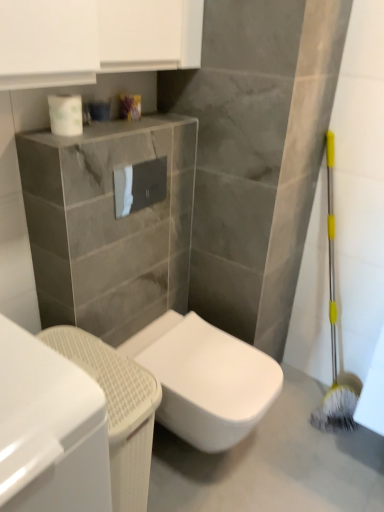
This screenshot has height=512, width=384. I want to click on white glossy toilet at center, so click(273, 464).

Locate an element on the screen. white glossy toilet at center is located at coordinates (205, 379).

At what (x,y) coordinates should I click in order to perform the action: click on white glossy toilet paper at upper center, placed as the 2th toilet paper when sorted from right to left. Please return your answer as a coordinate pair (x, y). The image size is (384, 512). Looking at the image, I should click on (65, 114).

From a real-world perspective, between white glossy toilet at center and white glossy toilet at center, who is vertically higher?

white glossy toilet at center, from a real-world perspective.

Can you confirm if white glossy toilet at center is positioned to the left of white glossy toilet at center?

In fact, white glossy toilet at center is to the right of white glossy toilet at center.

From the image's perspective, who appears lower, white glossy toilet at center or white glossy toilet at center?

From the image's view, white glossy toilet at center is below.

Considering the sizes of white glossy toilet at center and white glossy toilet at center in the image, is white glossy toilet at center taller or shorter than white glossy toilet at center?

white glossy toilet at center is shorter than white glossy toilet at center.

From the image's perspective, is white glossy toilet at lower left on top of white glossy toilet paper at upper center, acting as the second toilet paper starting from the back?

No, from the image's perspective, white glossy toilet at lower left is not over white glossy toilet paper at upper center, acting as the second toilet paper starting from the back.

From a real-world perspective, is white glossy toilet at lower left physically below white glossy toilet paper at upper center, the 1th toilet paper viewed from the left?

Yes.

Which object is wider, white glossy toilet at lower left or white glossy toilet paper at upper center, placed as the 2th toilet paper when sorted from right to left?

Wider between the two is white glossy toilet at lower left.

Which of these two, white glossy cabinet at lower left or white glossy toilet at lower left, is smaller?

With smaller size is white glossy toilet at lower left.

From the image's perspective, is white glossy cabinet at lower left above white glossy toilet at lower left?

Correct, white glossy cabinet at lower left appears higher than white glossy toilet at lower left in the image.

What are the coordinates of `cabinetry above the white glossy toilet at lower left (from a real-world perspective)` in the screenshot? It's located at (49, 430).

Is white glossy cabinet at lower left facing away from white glossy toilet at lower left?

No, white glossy cabinet at lower left is not facing away from white glossy toilet at lower left.

How distant is white glossy toilet paper at center, the 1th toilet paper from the bottom, from white glossy toilet at center?

white glossy toilet paper at center, the 1th toilet paper from the bottom, is 3.57 feet away from white glossy toilet at center.

Does white glossy toilet paper at center, arranged as the 2th toilet paper when viewed from the front, have a lesser width compared to white glossy toilet at center?

Yes.

Which point is more forward, [132,197] or [185,467]?

The point [185,467] is in front.

Is white glossy toilet paper at center, marked as the first toilet paper in a right-to-left arrangement, inside the boundaries of white glossy toilet at center, or outside?

The correct answer is: outside.

Does white glossy cabinet at lower left appear on the left side of white glossy toilet at center?

Yes.

Is white glossy toilet at center a part of white glossy cabinet at lower left?

Actually, white glossy toilet at center is outside white glossy cabinet at lower left.

Is white glossy cabinet at lower left next to white glossy toilet at center and touching it?

No, white glossy cabinet at lower left is not touching white glossy toilet at center.

From a real-world perspective, between white glossy cabinet at lower left and white glossy toilet at center, who is vertically higher?

white glossy cabinet at lower left.

From their relative heights in the image, would you say white glossy toilet at lower left is taller or shorter than white glossy toilet at center?

Considering their sizes, white glossy toilet at lower left has more height than white glossy toilet at center.

Is white glossy toilet at center at the back of white glossy toilet at lower left?

No, white glossy toilet at lower left is not facing away from white glossy toilet at center.

In the image, there is a white glossy toilet at lower left. Find the location of `concrete below it (from a real-world perspective)`. concrete below it (from a real-world perspective) is located at coordinates (273, 464).

Is white glossy toilet at lower left far away from white glossy toilet at center?

white glossy toilet at lower left is near white glossy toilet at center, not far away.

In terms of height, does white glossy cabinet at lower left look taller or shorter compared to white glossy toilet paper at center, the 2th toilet paper from the top?

In the image, white glossy cabinet at lower left appears to be taller than white glossy toilet paper at center, the 2th toilet paper from the top.

Considering the sizes of objects white glossy cabinet at lower left and white glossy toilet paper at center, marked as the first toilet paper in a right-to-left arrangement, in the image provided, who is wider, white glossy cabinet at lower left or white glossy toilet paper at center, marked as the first toilet paper in a right-to-left arrangement,?

white glossy cabinet at lower left.

This screenshot has height=512, width=384. There is a white glossy cabinet at lower left. In order to click on the 1st toilet paper above it (from a real-world perspective) in this screenshot , I will do `click(139, 186)`.

Does white glossy cabinet at lower left have a larger size compared to white glossy toilet paper at center, the 1th toilet paper from the bottom?

Indeed, white glossy cabinet at lower left has a larger size compared to white glossy toilet paper at center, the 1th toilet paper from the bottom.

Locate an element on the screen. This screenshot has width=384, height=512. concrete below the white glossy toilet at center (from the image's perspective) is located at coordinates (273, 464).

From a real-world perspective, starting from the white glossy toilet at lower left, which toilet paper is the 2nd one vertically above it? Please provide its 2D coordinates.

[(65, 114)]

Which object lies further to the anchor point white glossy cabinet at lower left, white glossy toilet at center or white glossy toilet at lower left?

Among the two, white glossy toilet at center is located further to white glossy cabinet at lower left.

Estimate the real-world distances between objects in this image. Which object is further from white glossy toilet at center, white glossy toilet at center or white glossy toilet paper at center, the 1th toilet paper from the bottom?

Based on the image, white glossy toilet paper at center, the 1th toilet paper from the bottom, appears to be further to white glossy toilet at center.

Which object lies further to the anchor point white glossy toilet paper at upper center, acting as the second toilet paper starting from the back, white glossy toilet at center or white glossy toilet at lower left?

white glossy toilet at center lies further to white glossy toilet paper at upper center, acting as the second toilet paper starting from the back, than the other object.

When comparing their distances from white glossy cabinet at lower left, does white glossy toilet at center or white glossy toilet at center seem further?

The object further to white glossy cabinet at lower left is white glossy toilet at center.

Which object lies nearer to the anchor point white glossy toilet paper at upper center, placed as the 2th toilet paper when sorted from right to left, white glossy toilet at lower left or white glossy toilet at center?

white glossy toilet at lower left lies closer to white glossy toilet paper at upper center, placed as the 2th toilet paper when sorted from right to left, than the other object.

Looking at this image, when comparing their distances from white glossy toilet paper at center, marked as the first toilet paper in a right-to-left arrangement, does white glossy toilet at center or white glossy cabinet at lower left seem closer?

white glossy cabinet at lower left lies closer to white glossy toilet paper at center, marked as the first toilet paper in a right-to-left arrangement, than the other object.

From the image, which object appears to be farther from white glossy toilet at center, white glossy cabinet at lower left or white glossy toilet paper at center, arranged as the 2th toilet paper when viewed from the front?

white glossy toilet paper at center, arranged as the 2th toilet paper when viewed from the front, lies further to white glossy toilet at center than the other object.

From the picture: When comparing their distances from white glossy toilet at center, does white glossy toilet at lower left or white glossy cabinet at lower left seem further?

The object further to white glossy toilet at center is white glossy cabinet at lower left.

The image size is (384, 512). Find the location of `toilet situated between white glossy cabinet at lower left and white glossy toilet at center from left to right`. toilet situated between white glossy cabinet at lower left and white glossy toilet at center from left to right is located at coordinates (205, 379).

This screenshot has height=512, width=384. In order to click on toilet between white glossy toilet paper at center, the first toilet paper from the back, and white glossy toilet at center in the up-down direction in this screenshot , I will do `click(205, 379)`.

Identify the location of toilet paper between white glossy toilet paper at upper center, the second toilet paper when ordered from bottom to top, and white glossy toilet at center from top to bottom. Image resolution: width=384 pixels, height=512 pixels. (139, 186).

This screenshot has height=512, width=384. Identify the location of toilet paper that lies between white glossy toilet paper at upper center, the 1th toilet paper when ordered from top to bottom, and white glossy toilet at lower left from top to bottom. (139, 186).